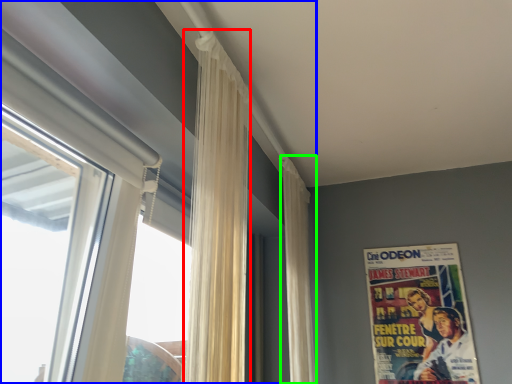
Question: Which object is the farthest from curtain (highlighted by a red box)? Choose among these: window (highlighted by a blue box) or curtain (highlighted by a green box).

Choices:
 (A) window
 (B) curtain

Answer: (B)